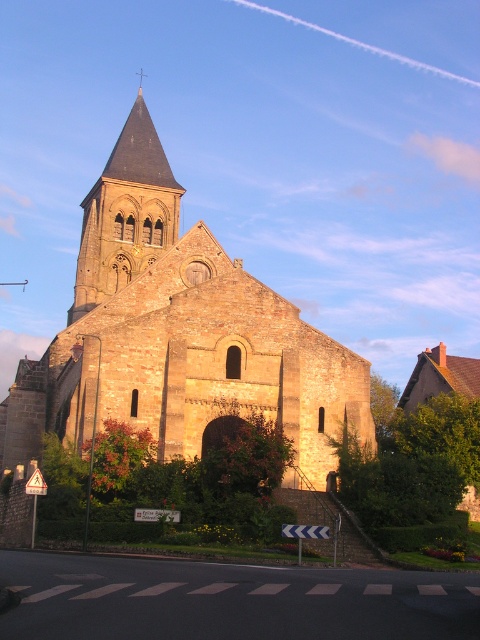
Question: Is golden stone tower at upper center smaller than gold stone spire at upper center?

Choices:
 (A) no
 (B) yes

Answer: (A)

Question: Based on their relative distances, which object is farther from the gold stone spire at upper center?

Choices:
 (A) golden stone tower at upper center
 (B) yellow stone church at center

Answer: (B)

Question: Is yellow stone church at center further to camera compared to golden stone tower at upper center?

Choices:
 (A) yes
 (B) no

Answer: (B)

Question: Which of the following is the closest to the observer?

Choices:
 (A) (104, 241)
 (B) (158, 342)
 (C) (144, 74)

Answer: (B)

Question: Which object appears farthest from the camera in this image?

Choices:
 (A) yellow stone church at center
 (B) golden stone tower at upper center

Answer: (B)

Question: Does yellow stone church at center appear on the left side of golden stone tower at upper center?

Choices:
 (A) yes
 (B) no

Answer: (A)